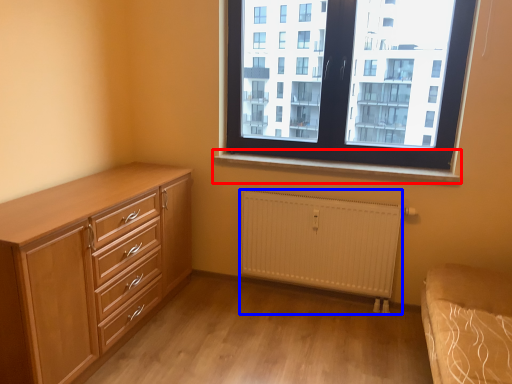
Question: Which object is further to the camera taking this photo, window sill (highlighted by a red box) or radiator (highlighted by a blue box)?

Choices:
 (A) window sill
 (B) radiator

Answer: (B)